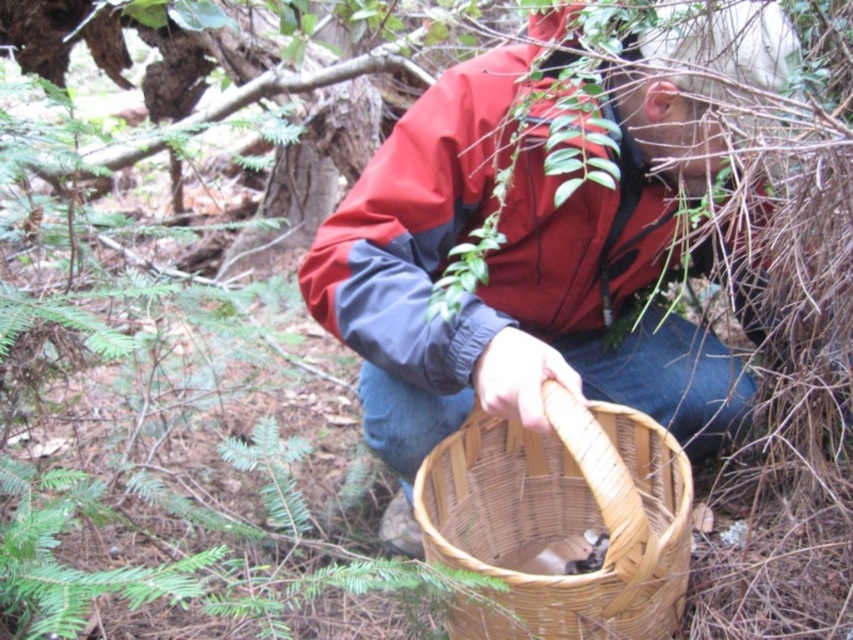
Question: Which of the following is the closest to the observer?

Choices:
 (A) woven bamboo basket at lower center
 (B) matte brown basket at center

Answer: (B)

Question: Which of the following is the closest to the observer?

Choices:
 (A) matte brown basket at center
 (B) woven bamboo basket at lower center

Answer: (A)

Question: In this image, where is matte brown basket at center located relative to woven bamboo basket at lower center?

Choices:
 (A) above
 (B) below

Answer: (A)

Question: Observing the image, what is the correct spatial positioning of matte brown basket at center in reference to woven bamboo basket at lower center?

Choices:
 (A) right
 (B) left

Answer: (A)

Question: Is matte brown basket at center smaller than woven bamboo basket at lower center?

Choices:
 (A) yes
 (B) no

Answer: (B)

Question: Which point is closer to the camera?

Choices:
 (A) (630, 237)
 (B) (596, 572)

Answer: (B)